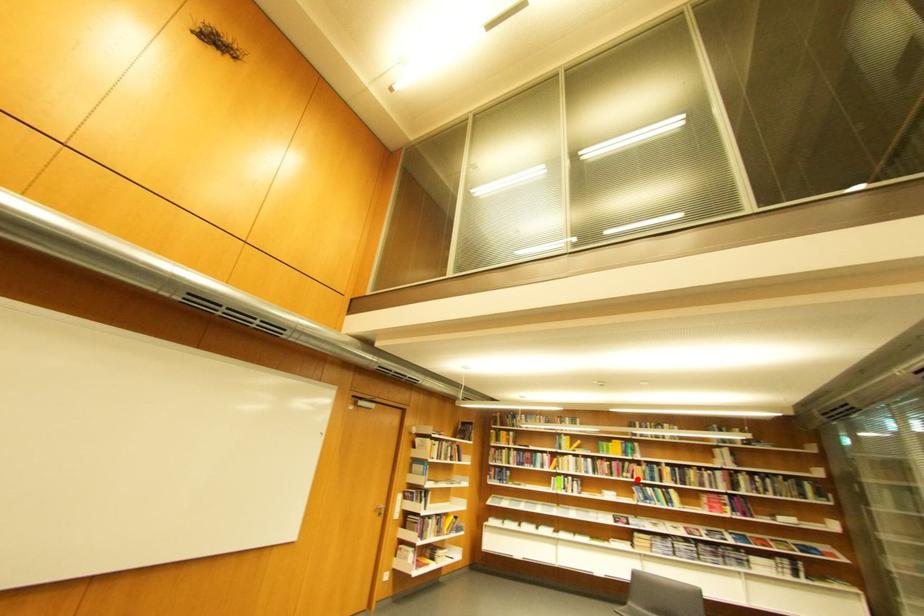
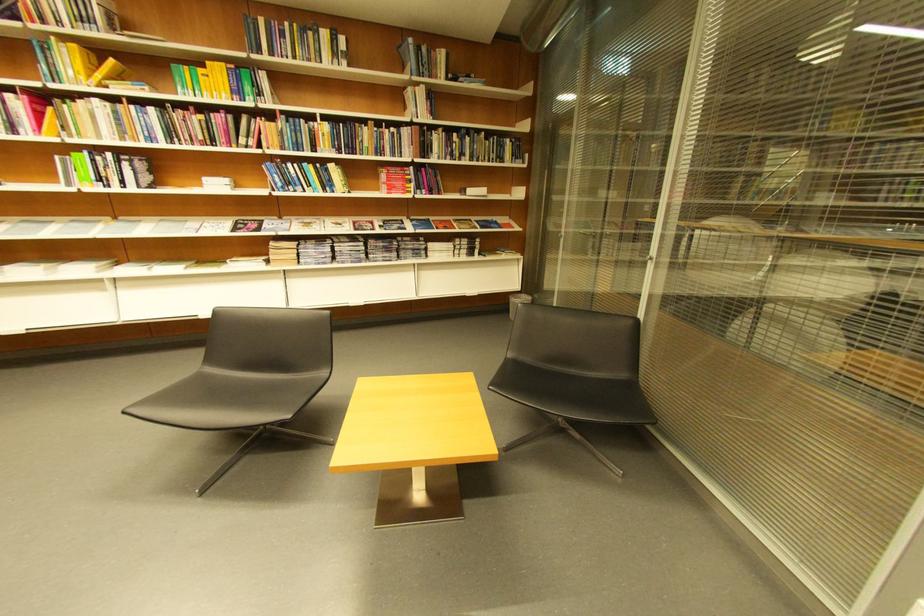
Question: I am providing you with two images of the same scene from different viewpoints. In image1, a red point is highlighted. Considering the same 3D point in image2, which of the following is correct?

Choices:
 (A) It is closer
 (B) It is farther

Answer: (A)